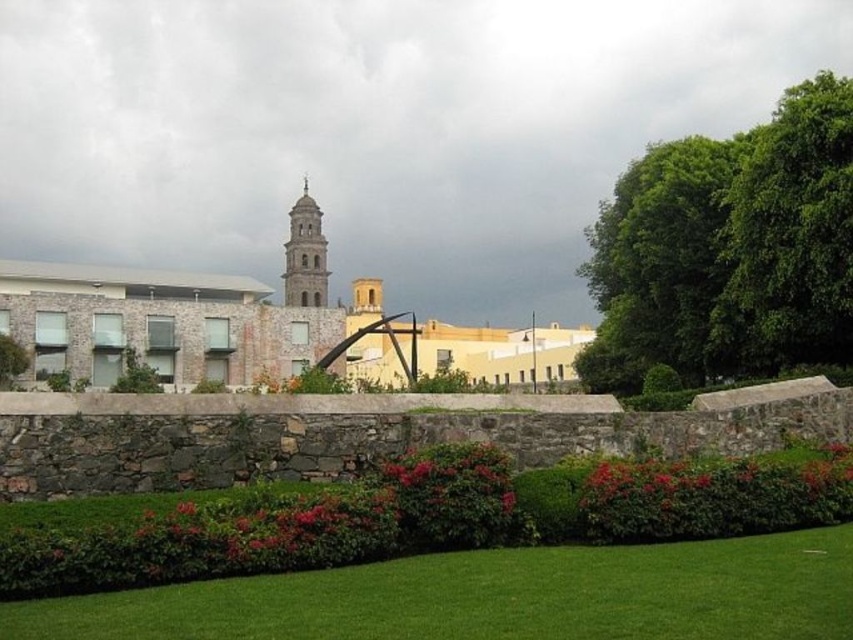
You are standing at the center of the grassy area bordered by the stone wall with red flowering shrubs. You want to take a photo of the green leafy tree at upper right without any obstructions. Which direction should you face to ensure the tree is in the frame and unobstructed by the buildings?

The green leafy tree at upper right is located at point (729,250), which is in the upper right area of the image. To capture it without obstructions from the buildings, you should face towards the upper right direction, ensuring the tree is centered in your viewfinder while avoiding the structures in the foreground and midground.